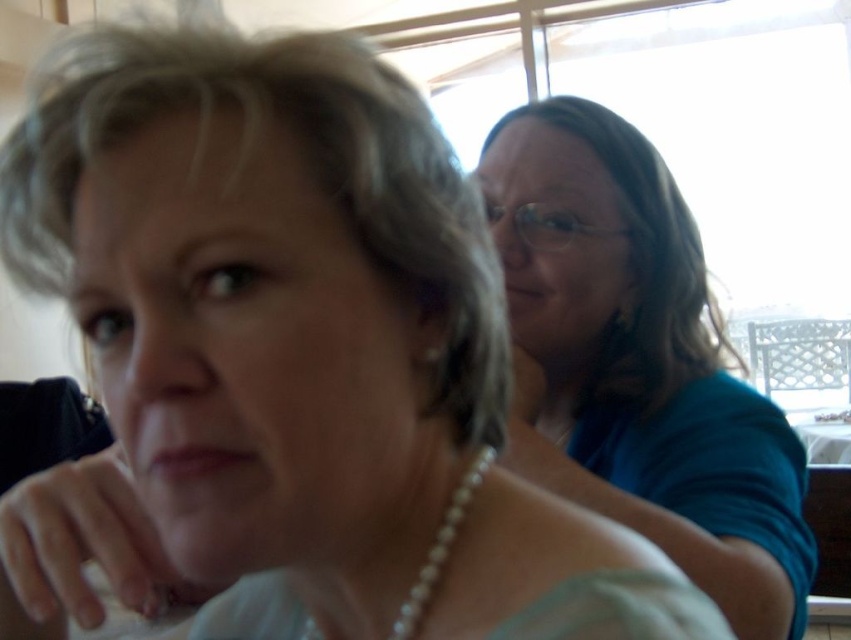
Question: Which object appears closest to the camera in this image?

Choices:
 (A) blue fabric shirt at upper right
 (B) pearl necklace at center
 (C) matte pearl necklace at lower center

Answer: (C)

Question: Which of the following is the closest to the observer?

Choices:
 (A) (473, 484)
 (B) (603, 403)
 (C) (214, 458)

Answer: (C)

Question: Does blue fabric shirt at upper right appear over pearl necklace at center?

Choices:
 (A) yes
 (B) no

Answer: (A)

Question: From the image, what is the correct spatial relationship of pearl necklace at center in relation to matte pearl necklace at lower center?

Choices:
 (A) left
 (B) right

Answer: (B)

Question: Which point is closer to the camera taking this photo?

Choices:
 (A) (243, 467)
 (B) (440, 545)
 (C) (566, 173)

Answer: (A)

Question: Is pearl necklace at center bigger than matte pearl necklace at lower center?

Choices:
 (A) yes
 (B) no

Answer: (A)